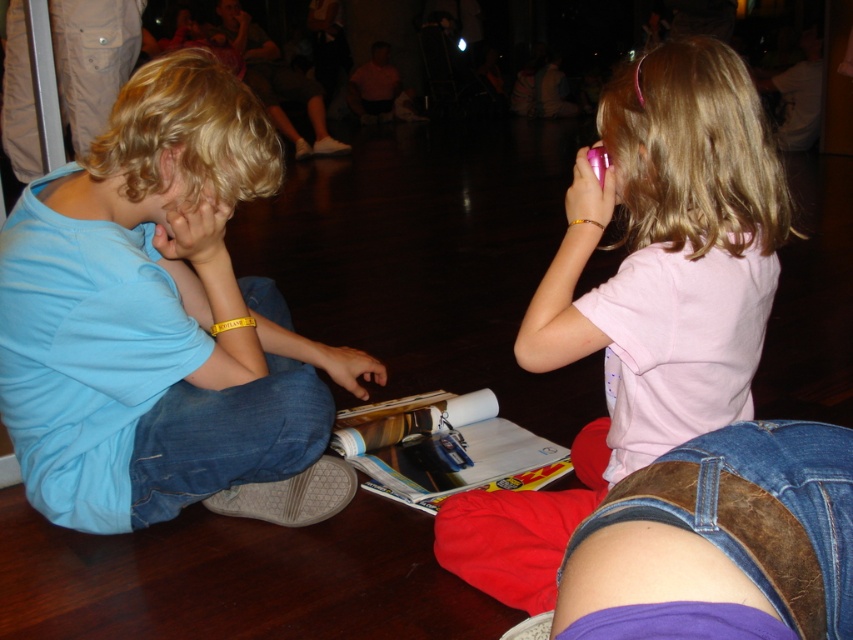
Question: Is matte blue shirt at left below pink matte phone at upper right?

Choices:
 (A) no
 (B) yes

Answer: (A)

Question: Which of these objects is positioned farthest from the pink matte phone at upper right?

Choices:
 (A) brown leather belt at lower right
 (B) matte blue shirt at left

Answer: (A)

Question: Does pink matte phone at upper right have a greater width compared to brown leather belt at lower right?

Choices:
 (A) yes
 (B) no

Answer: (A)

Question: Which object is farther from the camera taking this photo?

Choices:
 (A) brown leather belt at lower right
 (B) matte blue shirt at left

Answer: (B)

Question: Does matte blue shirt at left appear over pink matte phone at upper right?

Choices:
 (A) no
 (B) yes

Answer: (B)

Question: Which of the following is the closest to the observer?

Choices:
 (A) pink matte phone at upper right
 (B) matte blue shirt at left
 (C) brown leather belt at lower right

Answer: (C)